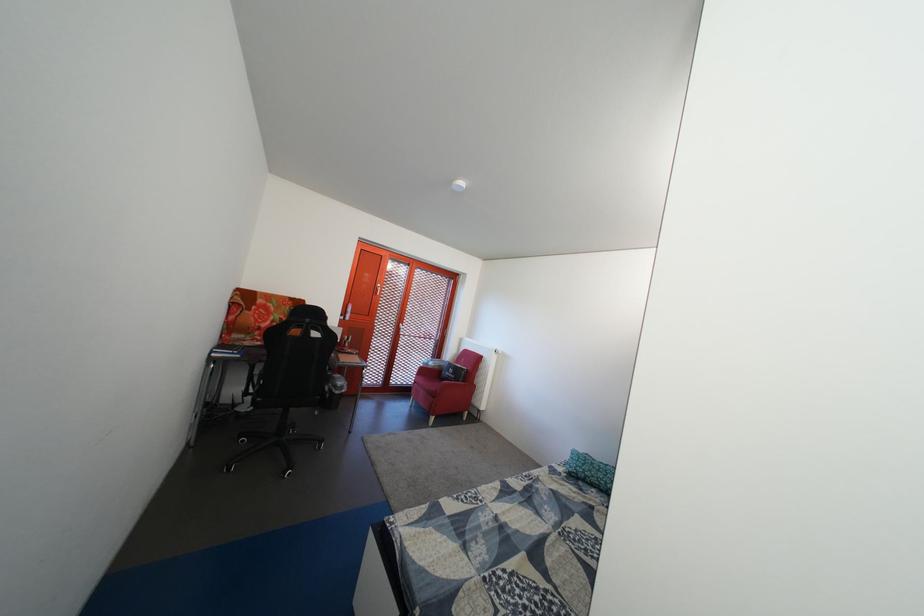
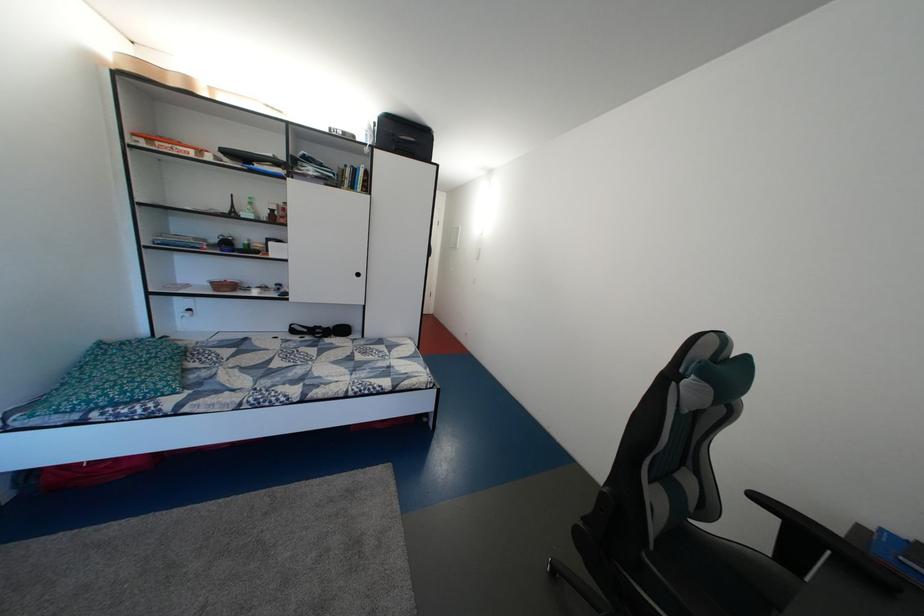
The point at (610, 477) is marked in the first image. Where is the corresponding point in the second image?

(160, 376)